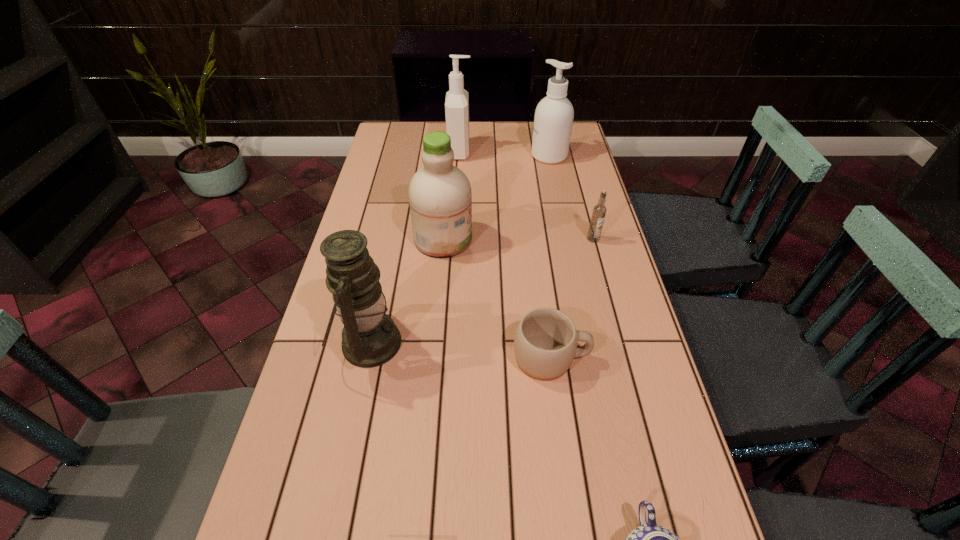
This screenshot has height=540, width=960. What are the coordinates of `vacant area at the far right corner of the desktop` in the screenshot? It's located at (579, 135).

Where is `free space between the rightmost cleansing agent and the fifth tallest object`? free space between the rightmost cleansing agent and the fifth tallest object is located at coordinates (571, 197).

You are a GUI agent. You are given a task and a screenshot of the screen. Output one action in this format:
    pyautogui.click(x=<x>, y=<y>)
    Task: Click on the free space between the oil lamp and the nearest cleansing agent
    
    Given the screenshot: What is the action you would take?
    pyautogui.click(x=406, y=291)

The width and height of the screenshot is (960, 540). I want to click on free spot between the nearest cleansing agent and the oil lamp, so click(406, 291).

The width and height of the screenshot is (960, 540). Find the location of `the sixth closest object to the nearest object`. the sixth closest object to the nearest object is located at coordinates (457, 101).

Locate which object ranks fourth in proximity to the chinaware. Please provide its 2D coordinates. Your answer should be formatted as a tuple, i.e. [(x, y)], where the tuple contains the x and y coordinates of a point satisfying the conditions above.

[(599, 211)]

Where is `cleansing agent that can be found as the third closest to the nearest object`? Image resolution: width=960 pixels, height=540 pixels. cleansing agent that can be found as the third closest to the nearest object is located at coordinates (457, 101).

Locate which cleansing agent is the second closest to the rightmost cleansing agent. Please provide its 2D coordinates. Your answer should be formatted as a tuple, i.e. [(x, y)], where the tuple contains the x and y coordinates of a point satisfying the conditions above.

[(440, 197)]

Where is `vacant space that satisfies the following two spatial constraints: 1. on the label of the vodka; 2. on the side of the mug with the handle`? Image resolution: width=960 pixels, height=540 pixels. vacant space that satisfies the following two spatial constraints: 1. on the label of the vodka; 2. on the side of the mug with the handle is located at coordinates point(625,357).